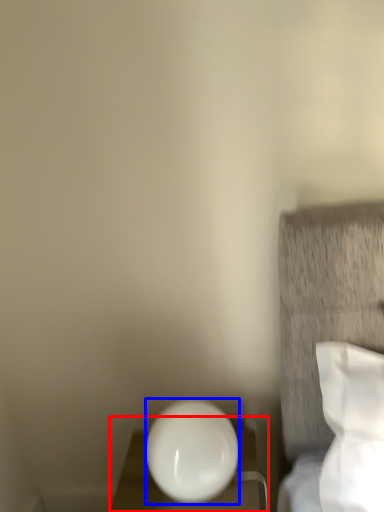
Question: Which point is closer to the camera, furniture (highlighted by a red box) or oval (highlighted by a blue box)?

Choices:
 (A) furniture
 (B) oval

Answer: (B)